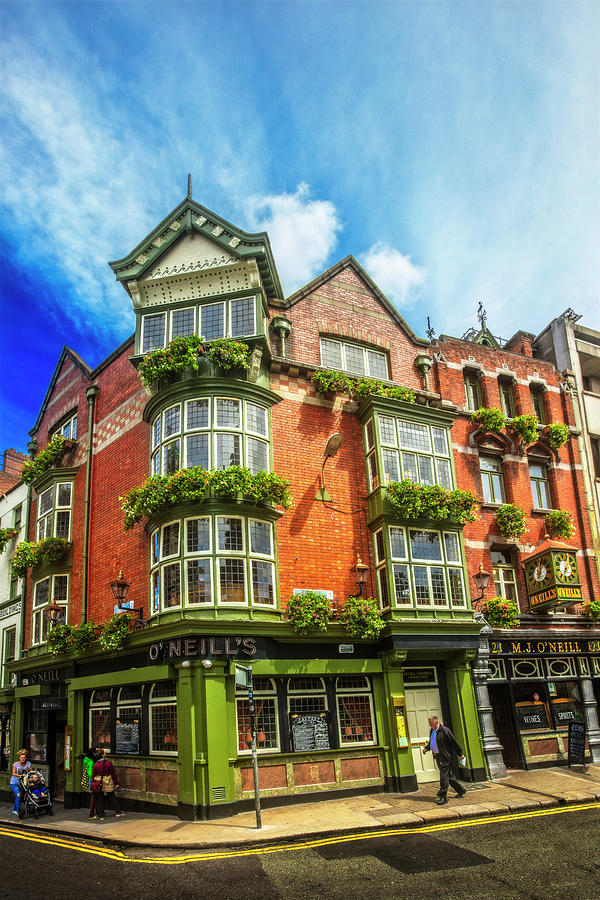
Find the location of a particular element. The image size is (600, 900). door is located at coordinates (426, 707), (57, 752).